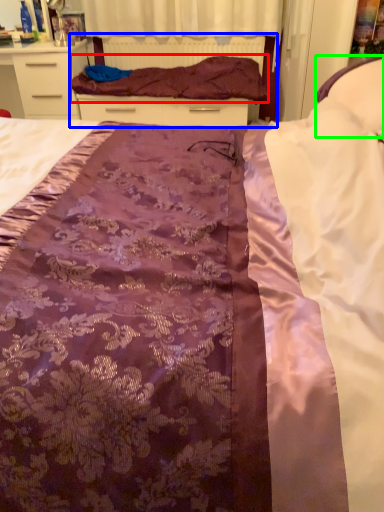
Question: Which object is positioned closest to blanket (highlighted by a red box)? Select from bed frame (highlighted by a blue box) and pillow (highlighted by a green box).

Choices:
 (A) bed frame
 (B) pillow

Answer: (A)